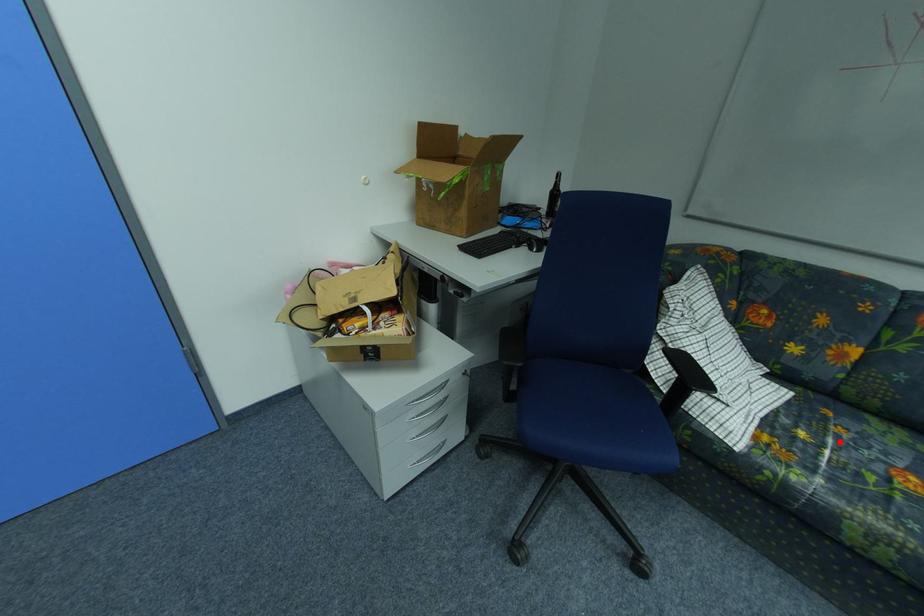
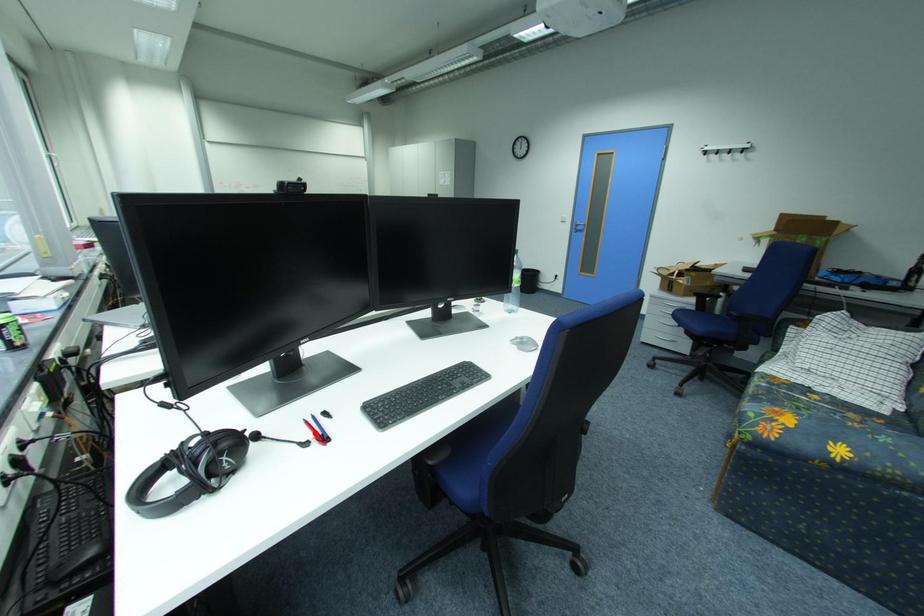
From the picture: I am providing you with two images of the same scene from different viewpoints. A red point is marked on the first image and another point is marked on the second image. Are the points marked in image1 and image2 representing the same 3D position?

No